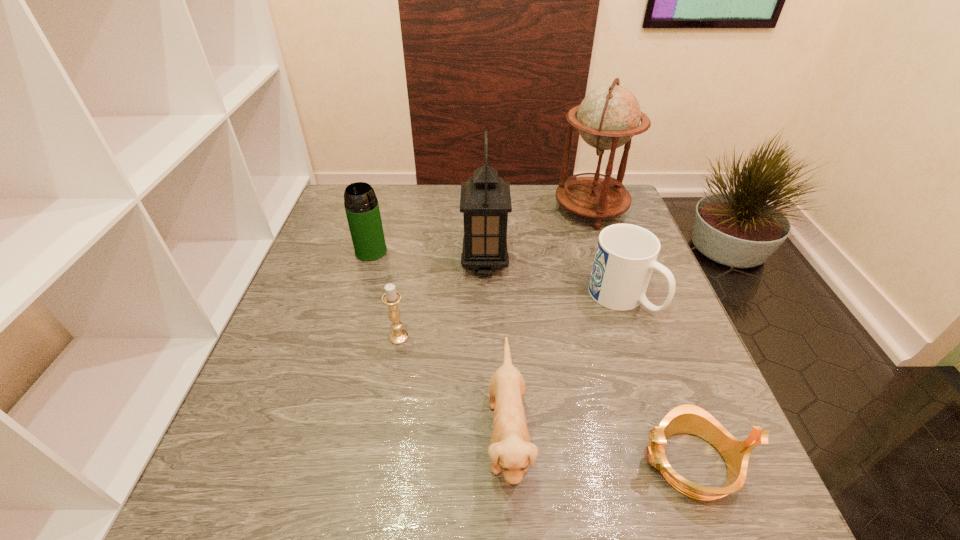
Find the location of a particular element. blank area located at the front emblem of the shortest object is located at coordinates (589, 462).

You are a GUI agent. You are given a task and a screenshot of the screen. Output one action in this format:
    pyautogui.click(x=<x>, y=<y>)
    Task: Click on the vacant space positioned at the front emblem of the shortest object
    
    Given the screenshot: What is the action you would take?
    pyautogui.click(x=595, y=462)

You are a GUI agent. You are given a task and a screenshot of the screen. Output one action in this format:
    pyautogui.click(x=<x>, y=<y>)
    Task: Click on the object located at the far edge
    
    Given the screenshot: What is the action you would take?
    pyautogui.click(x=608, y=117)

The width and height of the screenshot is (960, 540). I want to click on puppy that is at the near edge, so click(510, 449).

Locate an element on the screen. This screenshot has height=540, width=960. tiara that is at the near edge is located at coordinates (687, 418).

Identify the location of object present at the left edge. The width and height of the screenshot is (960, 540). (361, 205).

Find the location of a particular element. The width and height of the screenshot is (960, 540). globe that is at the right edge is located at coordinates (608, 117).

At what (x,y) coordinates should I click in order to perform the action: click on mug that is positioned at the right edge. Please return your answer as a coordinate pair (x, y). Image resolution: width=960 pixels, height=540 pixels. Looking at the image, I should click on (626, 254).

You are a GUI agent. You are given a task and a screenshot of the screen. Output one action in this format:
    pyautogui.click(x=<x>, y=<y>)
    Task: Click on the tiara present at the right edge
    Image resolution: width=960 pixels, height=540 pixels.
    Given the screenshot: What is the action you would take?
    pyautogui.click(x=687, y=418)

Find the location of a particular element. This screenshot has height=540, width=960. object situated at the far right corner is located at coordinates (608, 117).